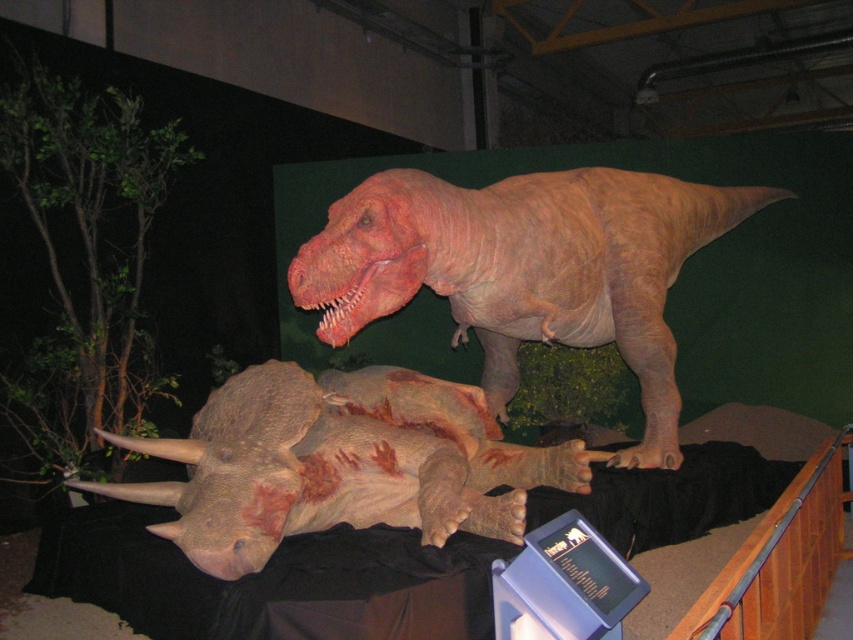
Which is below, smooth tan dinosaur at upper center or brown textured dinosaur at lower center?

brown textured dinosaur at lower center is lower down.

Between smooth tan dinosaur at upper center and brown textured dinosaur at lower center, which one appears on the left side from the viewer's perspective?

brown textured dinosaur at lower center is more to the left.

Does point (486, 394) come farther from viewer compared to point (421, 460)?

Yes, it is behind point (421, 460).

Identify the location of smooth tan dinosaur at upper center. The height and width of the screenshot is (640, 853). (526, 268).